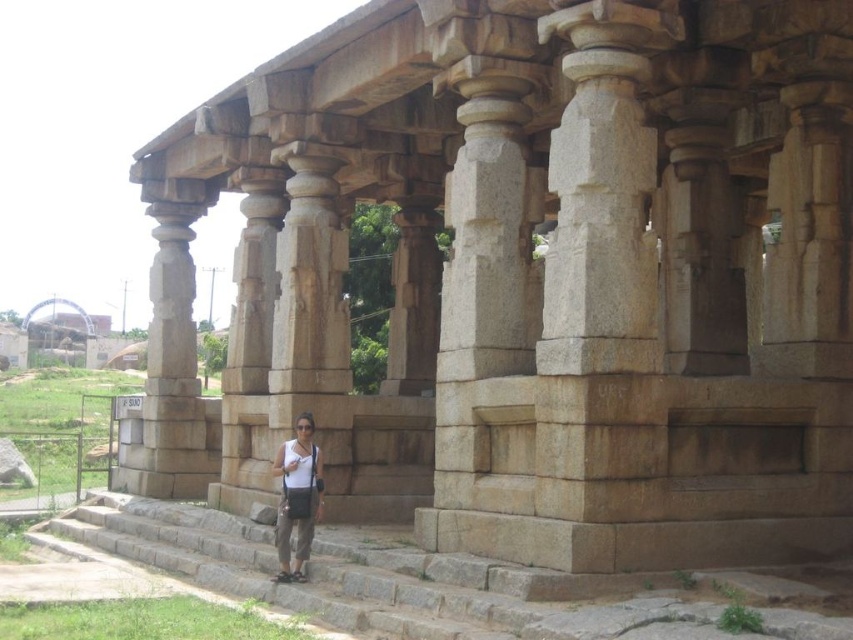
You are standing at the entrance of the ancient stone structure and want to reach the top of the brown stone stairs at center. Which direction should you move relative to the structure?

The brown stone stairs at center are located at coordinates point (x=410, y=582), so you should move towards the center of the structure to reach them.

You are a tour guide explaining the ancient stone structure to visitors. You point out the brown stone stairs at center and the matte white shirt at center. Which object is wider?

The brown stone stairs at center is wider than the matte white shirt at center.

You are standing at the entrance of the ancient stone structure and want to take a photo of the brown stone stairs at center and the matte white shirt at center. Which object should you focus on first to ensure both are in the frame?

You should focus on the brown stone stairs at center first since it is in front of the matte white shirt at center, ensuring both will be captured in the photo.